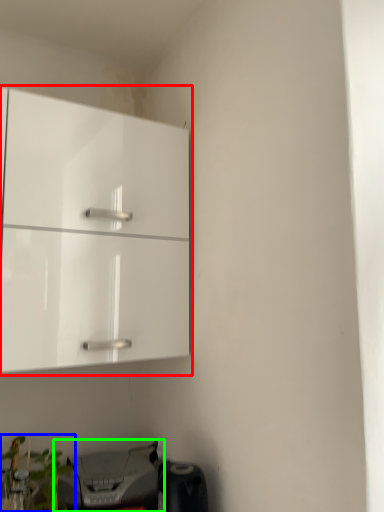
Question: Which object is the closest to the cabinetry (highlighted by a red box)? Choose among these: plant (highlighted by a blue box) or printer (highlighted by a green box).

Choices:
 (A) plant
 (B) printer

Answer: (B)